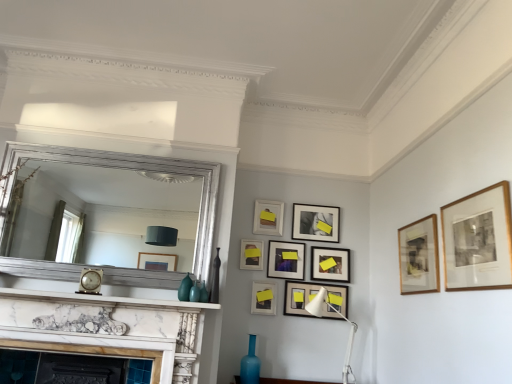
Question: Which direction should I rotate to look at blue glass vase at lower center, marked as the third vase in a left-to-right arrangement, — up or down?

Choices:
 (A) up
 (B) down

Answer: (B)

Question: Does metallic silver clock at center have a greater height compared to wooden framed artwork at upper right, which is the second picture frame from front to back?

Choices:
 (A) no
 (B) yes

Answer: (A)

Question: Is metallic silver clock at center oriented towards wooden framed artwork at upper right, positioned as the eighth picture frame in back-to-front order?

Choices:
 (A) no
 (B) yes

Answer: (A)

Question: Considering the relative positions of metallic silver clock at center and wooden framed artwork at upper right, positioned as the eighth picture frame in back-to-front order, in the image provided, is metallic silver clock at center to the right of wooden framed artwork at upper right, positioned as the eighth picture frame in back-to-front order, from the viewer's perspective?

Choices:
 (A) yes
 (B) no

Answer: (B)

Question: Can you confirm if metallic silver clock at center is thinner than wooden framed artwork at upper right, which is the second picture frame from front to back?

Choices:
 (A) yes
 (B) no

Answer: (B)

Question: From a real-world perspective, is metallic silver clock at center positioned over wooden framed artwork at upper right, positioned as the eighth picture frame in back-to-front order, based on gravity?

Choices:
 (A) yes
 (B) no

Answer: (B)

Question: From the image's perspective, is metallic silver clock at center located above wooden framed artwork at upper right, positioned as the eighth picture frame in back-to-front order?

Choices:
 (A) no
 (B) yes

Answer: (A)

Question: Is black glass vase at center, the 1th vase in the top-to-bottom sequence, not near metallic silver clock at center?

Choices:
 (A) no
 (B) yes

Answer: (A)

Question: Is black glass vase at center, the 1th vase in the top-to-bottom sequence, at the left side of metallic silver clock at center?

Choices:
 (A) no
 (B) yes

Answer: (A)

Question: Does black glass vase at center, which is the third vase in bottom-to-top order, have a lesser width compared to metallic silver clock at center?

Choices:
 (A) no
 (B) yes

Answer: (B)

Question: From a real-world perspective, is black glass vase at center, which is counted as the second vase, starting from the left, on metallic silver clock at center?

Choices:
 (A) yes
 (B) no

Answer: (A)

Question: Considering the relative positions of black glass vase at center, which is the third vase in bottom-to-top order, and metallic silver clock at center in the image provided, is black glass vase at center, which is the third vase in bottom-to-top order, to the right of metallic silver clock at center from the viewer's perspective?

Choices:
 (A) no
 (B) yes

Answer: (B)

Question: From the image's perspective, would you say black glass vase at center, which is the third vase in bottom-to-top order, is shown under metallic silver clock at center?

Choices:
 (A) yes
 (B) no

Answer: (B)

Question: Is matte black picture frame at lower center, arranged as the sixth picture frame when viewed from the back, looking in the opposite direction of wooden framed artwork at upper right, which is the second picture frame from front to back?

Choices:
 (A) no
 (B) yes

Answer: (A)